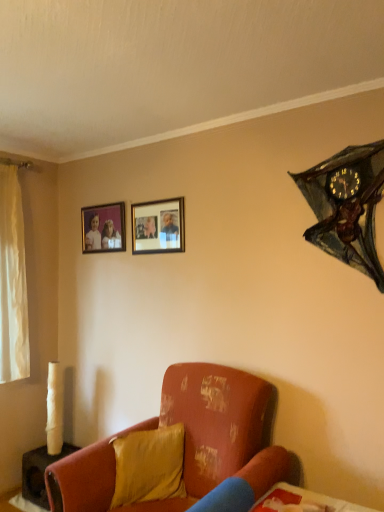
Question: From a real-world perspective, is distressed orange fabric couch at lower center beneath metallic bat-shaped clock at upper right?

Choices:
 (A) no
 (B) yes

Answer: (B)

Question: Does distressed orange fabric couch at lower center contain metallic bat-shaped clock at upper right?

Choices:
 (A) no
 (B) yes

Answer: (A)

Question: Can you confirm if distressed orange fabric couch at lower center is wider than metallic bat-shaped clock at upper right?

Choices:
 (A) no
 (B) yes

Answer: (B)

Question: Can you see distressed orange fabric couch at lower center touching metallic bat-shaped clock at upper right?

Choices:
 (A) no
 (B) yes

Answer: (A)

Question: Considering the relative sizes of distressed orange fabric couch at lower center and metallic bat-shaped clock at upper right in the image provided, is distressed orange fabric couch at lower center shorter than metallic bat-shaped clock at upper right?

Choices:
 (A) no
 (B) yes

Answer: (A)

Question: Is distressed orange fabric couch at lower center facing towards metallic bat-shaped clock at upper right?

Choices:
 (A) no
 (B) yes

Answer: (A)

Question: From the image's perspective, does matte wooden picture frame at upper left, the second picture frame positioned from the front, appear higher than matte black picture frame at upper center, arranged as the 2th picture frame when viewed from the left?

Choices:
 (A) yes
 (B) no

Answer: (A)

Question: From the image's perspective, is matte wooden picture frame at upper left, positioned as the 1th picture frame in left-to-right order, under matte black picture frame at upper center, which is the second picture frame in back-to-front order?

Choices:
 (A) yes
 (B) no

Answer: (B)

Question: Can you confirm if matte wooden picture frame at upper left, positioned as the 1th picture frame in left-to-right order, is positioned to the right of matte black picture frame at upper center, arranged as the 2th picture frame when viewed from the left?

Choices:
 (A) yes
 (B) no

Answer: (B)

Question: Is the position of matte wooden picture frame at upper left, which is the second picture frame from right to left, more distant than that of matte black picture frame at upper center, the first picture frame when ordered from right to left?

Choices:
 (A) no
 (B) yes

Answer: (B)

Question: Is matte wooden picture frame at upper left, which appears as the first picture frame when viewed from the back, facing away from matte black picture frame at upper center, which is the second picture frame in back-to-front order?

Choices:
 (A) yes
 (B) no

Answer: (B)

Question: Is matte wooden picture frame at upper left, which appears as the first picture frame when viewed from the back, at the left side of matte black picture frame at upper center, acting as the 1th picture frame starting from the front?

Choices:
 (A) yes
 (B) no

Answer: (A)

Question: Is satin yellow pillow at lower center further to camera compared to matte wooden picture frame at upper left, the second picture frame positioned from the front?

Choices:
 (A) yes
 (B) no

Answer: (B)